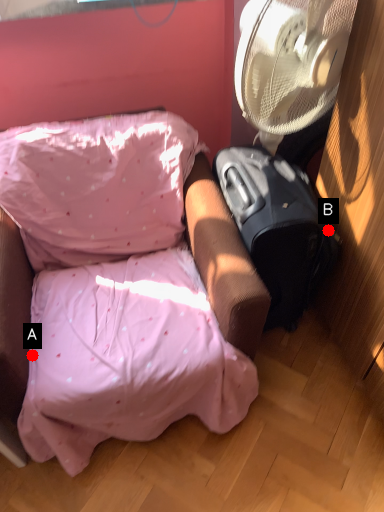
Question: Two points are circled on the image, labeled by A and B beside each circle. Which point appears farthest from the camera in this image?

Choices:
 (A) A is further
 (B) B is further

Answer: (B)